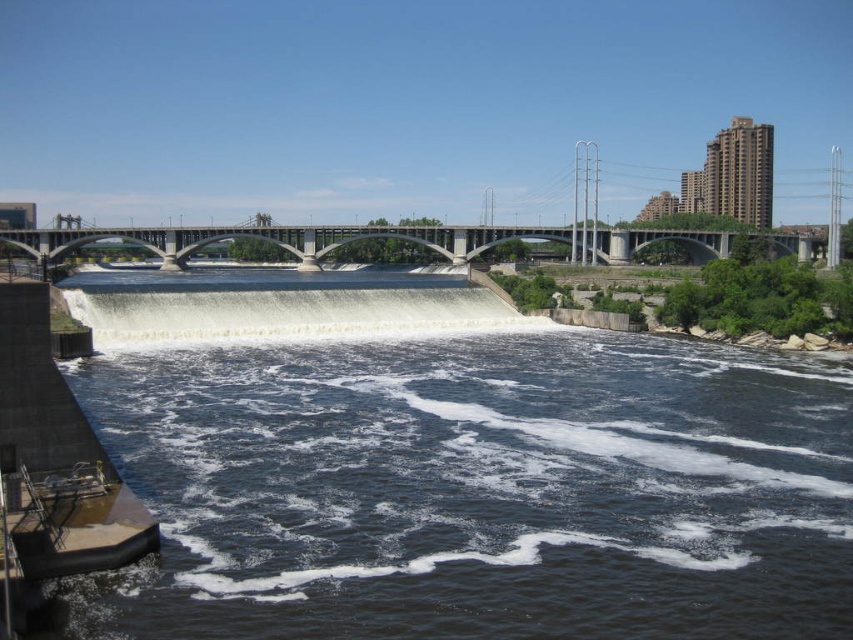
Is dark blue water at lower left positioned before concrete bridge at center?

Yes, dark blue water at lower left is closer to the viewer.

Is dark blue water at lower left wider than concrete bridge at center?

Incorrect, dark blue water at lower left's width does not surpass concrete bridge at center's.

Identify the location of dark blue water at lower left. Image resolution: width=853 pixels, height=640 pixels. (476, 490).

Image resolution: width=853 pixels, height=640 pixels. I want to click on dark blue water at lower left, so click(476, 490).